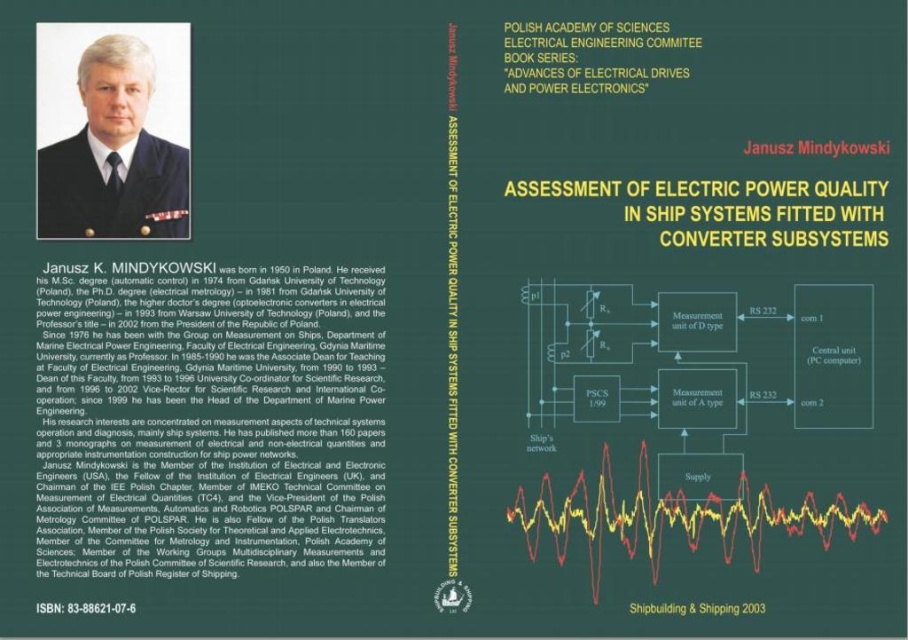
Is white paper at upper center behind green paper at upper center?

That is True.

Can you confirm if white paper at upper center is positioned to the right of green paper at upper center?

No, white paper at upper center is not to the right of green paper at upper center.

Between point (577, 70) and point (673, 605), which one is positioned in front?

Point (673, 605) is in front.

This screenshot has width=908, height=640. What are the coordinates of `white paper at upper center` in the screenshot? It's located at (583, 52).

Can you confirm if yellow text at upper center is shorter than green paper at upper center?

No.

Is yellow text at upper center closer to camera compared to green paper at upper center?

No.

Who is more forward, (667, 211) or (693, 608)?

Positioned in front is point (693, 608).

Where is `yellow text at upper center`? Image resolution: width=908 pixels, height=640 pixels. yellow text at upper center is located at coordinates (754, 212).

Does matte black uniform at upper left have a lesser height compared to white paper at upper center?

No.

Is matte black uniform at upper left positioned in front of white paper at upper center?

That is True.

The width and height of the screenshot is (908, 640). In order to click on matte black uniform at upper left in this screenshot , I will do `click(114, 156)`.

What are the coordinates of `matte black uniform at upper left` in the screenshot? It's located at (114, 156).